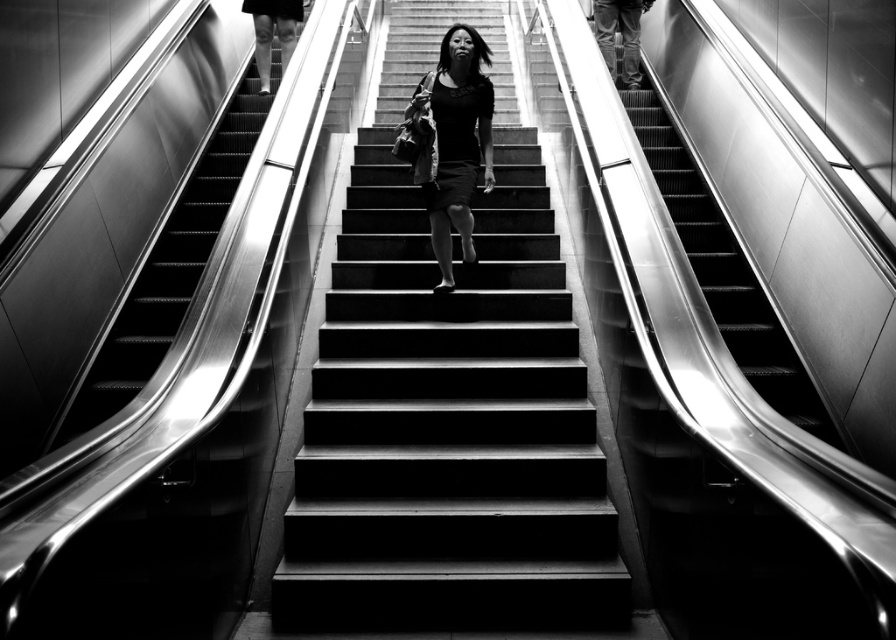
Question: Can you confirm if smooth concrete stairs at center is positioned above metallic escalator at left?

Choices:
 (A) no
 (B) yes

Answer: (A)

Question: Is smooth concrete stairs at center above metallic silver stairs at right?

Choices:
 (A) no
 (B) yes

Answer: (A)

Question: Can you confirm if metallic escalator at left is positioned to the left of metallic silver stairs at right?

Choices:
 (A) yes
 (B) no

Answer: (A)

Question: Which point appears closest to the camera in this image?

Choices:
 (A) pos(390,49)
 (B) pos(426,192)

Answer: (B)

Question: Which point is farther to the camera?

Choices:
 (A) (494, 40)
 (B) (485, 147)
 (C) (274, 88)

Answer: (A)

Question: Which object appears closest to the camera in this image?

Choices:
 (A) smooth concrete stairs at center
 (B) black matte dress at center

Answer: (A)